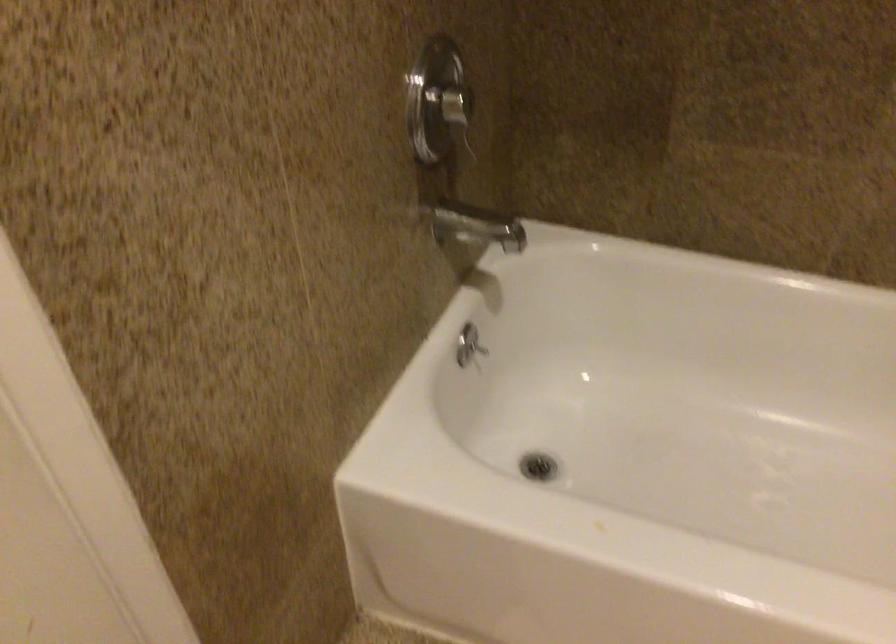
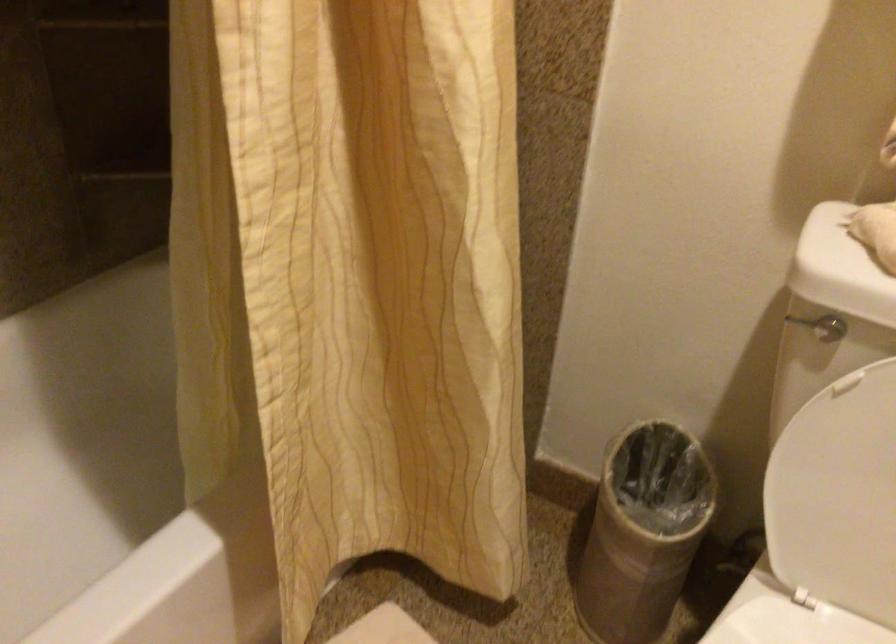
First-person continuous shooting, in which direction is the camera rotating?

The camera rotated toward right-down.